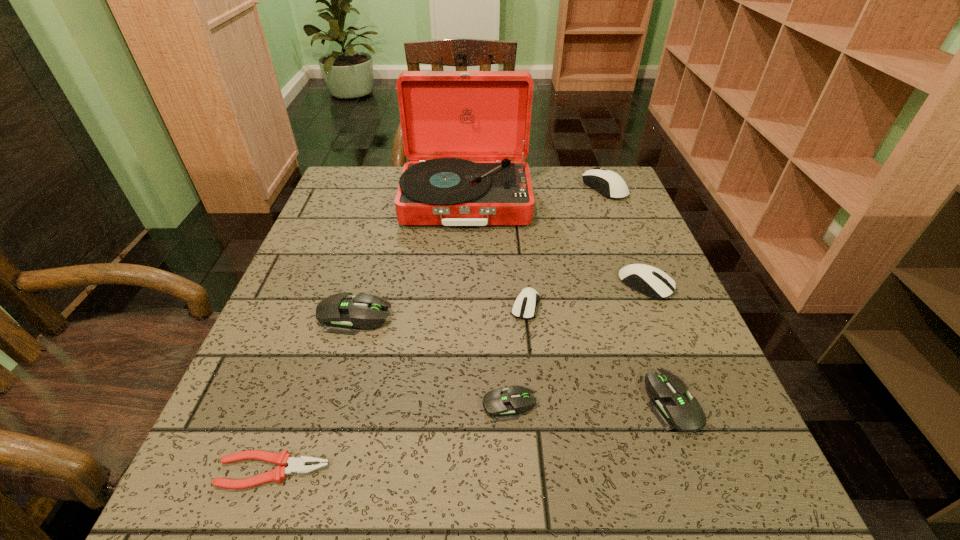
Image resolution: width=960 pixels, height=540 pixels. In order to click on the shortest object in this screenshot , I will do `click(297, 465)`.

Locate an element on the screen. This screenshot has height=540, width=960. pliers is located at coordinates (297, 465).

The height and width of the screenshot is (540, 960). Identify the location of vacant space located on the front-facing side of the phonograph_record. (463, 279).

Locate an element on the screen. vacant area situated 0.250m on the left of the farthest computer mouse is located at coordinates (495, 188).

Where is `free space located 0.220m on the left of the second smallest white mouse`? The width and height of the screenshot is (960, 540). free space located 0.220m on the left of the second smallest white mouse is located at coordinates (518, 285).

The image size is (960, 540). Find the location of `vacant space located on the front of the leftmost gray computer mouse`. vacant space located on the front of the leftmost gray computer mouse is located at coordinates (306, 490).

I want to click on vacant space located on the left of the smallest white mouse, so point(419,306).

In order to click on vacant space located on the back of the rightmost gray computer mouse in this screenshot , I will do `click(623, 268)`.

This screenshot has width=960, height=540. I want to click on free space located 0.390m on the back of the smallest gray computer mouse, so click(x=500, y=248).

At what (x,y) coordinates should I click in order to perform the action: click on free space located on the back of the pliers. Please return your answer as a coordinate pair (x, y). The image size is (960, 540). Looking at the image, I should click on (316, 349).